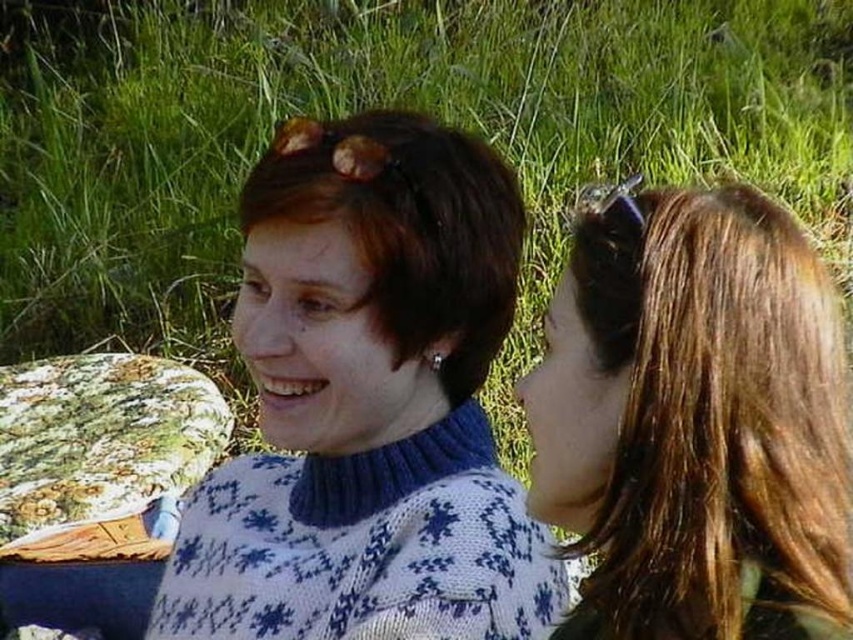
You are a photographer trying to capture a closeup of the white knitted sweater at center and the matte blue sweater at center. Which sweater should you focus on first to ensure it appears sharp in the photo?

The white knitted sweater at center is closer to the viewer than the matte blue sweater at center, so you should focus on the white knitted sweater at center first to ensure it appears sharp.

You are standing in front of the image and want to touch the shiny brown hair at right. To reach it, you need to move your hand from the center of the image. In which direction should you move your hand relative to the center?

The shiny brown hair at right is located at point 0.656 on the x axis and 0.815 on the y axis. Since the x coordinate is greater than 0.5, you should move your hand to the right from the center. The y coordinate is also greater than 0.5, so you should move upwards as well. Therefore, you need to move your hand to the upper right direction from the center.

You are a photographer trying to capture a candid shot of the shiny brown hair at right and the white knitted sweater at center. Since you want to focus on both subjects, which one should you adjust your camera focus to first based on their positions?

The white knitted sweater at center is below shiny brown hair at right, so you should focus on the shiny brown hair at right first since it is higher up and closer to the top of the frame.